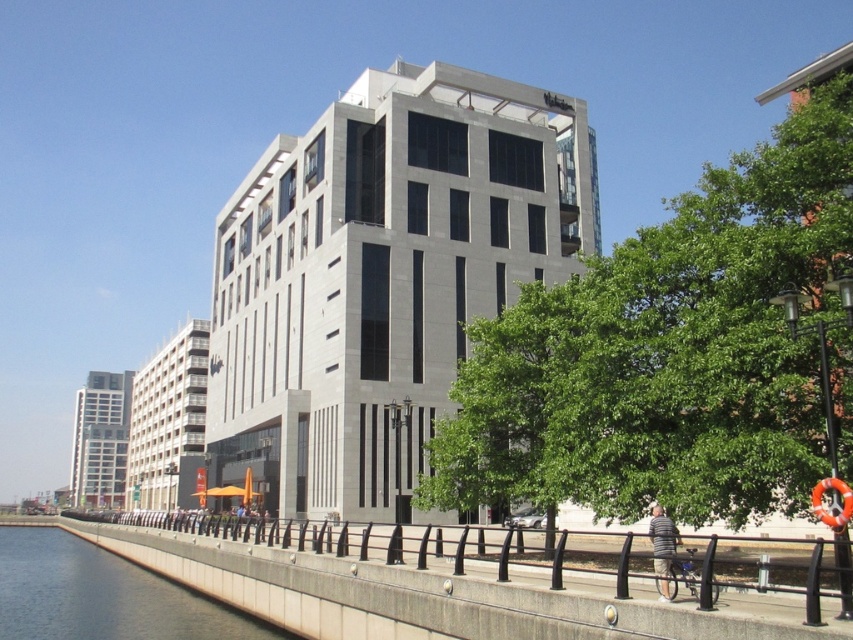
You are standing on the waterfront promenade and see the gray concrete wall at lower left and the striped cotton shirt at lower right. Which object is closer to the ground?

The gray concrete wall at lower left is located below striped cotton shirt at lower right, so it is closer to the ground.

You are a delivery person trying to navigate through the waterfront promenade. You need to pass between the gray concrete wall at lower left and the striped cotton shirt at lower right. Can you estimate if there is enough space for your 1.2 meter wide delivery cart?

The gray concrete wall at lower left might be wider than striped cotton shirt at lower right, so the distance between them is uncertain. It is recommended to check the actual space before proceeding with the delivery cart.

You are standing on the waterfront promenade and see two points marked in the image. One is labeled as point (65,548) and the other as point (666,554). Which point is closer to you?

Point (65,548) is closer to you because it is further to the camera than point (666,554).